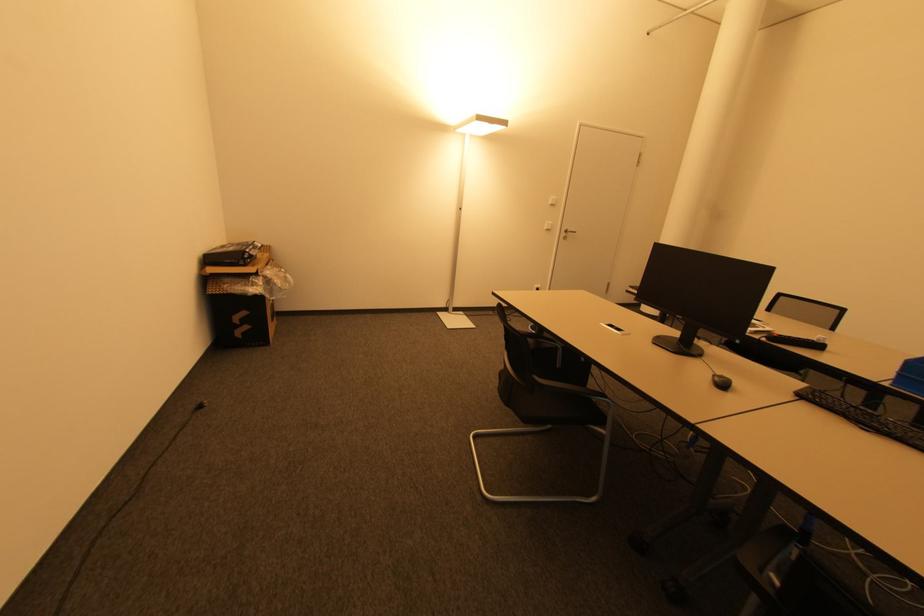
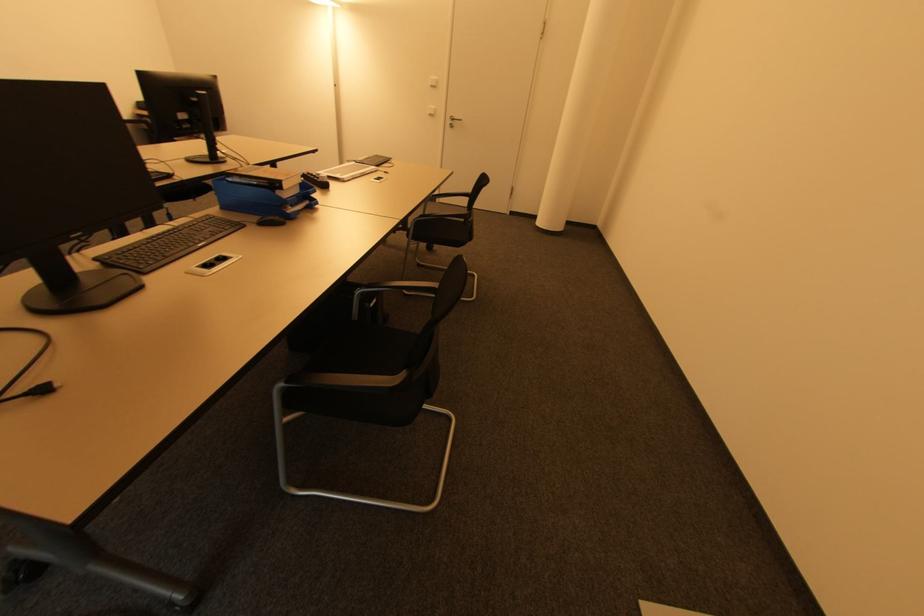
Find the pixel in the second image that matches pixel 553 206 in the first image.

(434, 87)